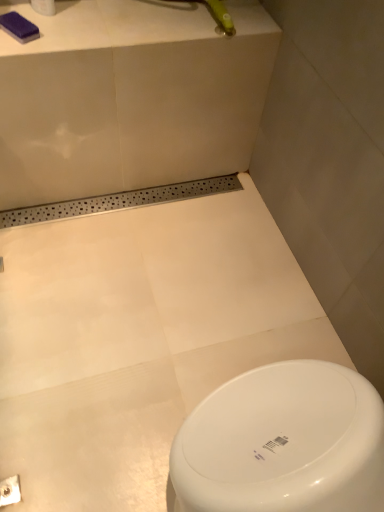
Question: From their relative heights in the image, would you say white matte toilet paper at upper left is taller or shorter than white glossy bath at lower center?

Choices:
 (A) short
 (B) tall

Answer: (A)

Question: From a real-world perspective, is white matte toilet paper at upper left above or below white glossy bath at lower center?

Choices:
 (A) above
 (B) below

Answer: (A)

Question: In terms of size, does white matte toilet paper at upper left appear bigger or smaller than white glossy bath at lower center?

Choices:
 (A) big
 (B) small

Answer: (B)

Question: From a real-world perspective, is white glossy bath at lower center positioned above or below white matte toilet paper at upper left?

Choices:
 (A) below
 (B) above

Answer: (A)

Question: From the image's perspective, is white glossy bath at lower center positioned above or below white matte toilet paper at upper left?

Choices:
 (A) below
 (B) above

Answer: (A)

Question: Visually, is white glossy bath at lower center positioned to the left or to the right of white matte toilet paper at upper left?

Choices:
 (A) right
 (B) left

Answer: (A)

Question: Do you think white glossy bath at lower center is within white matte toilet paper at upper left, or outside of it?

Choices:
 (A) inside
 (B) outside

Answer: (B)